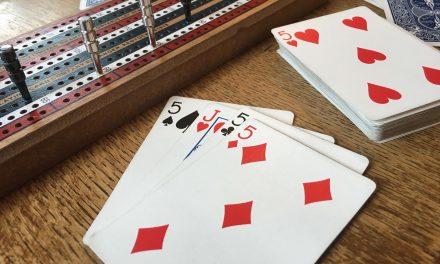
At what (x,y) coordinates should I click in order to perform the action: click on shadow on table. Please return your answer as a coordinate pair (x, y). The image size is (440, 264). Looking at the image, I should click on (9, 16).